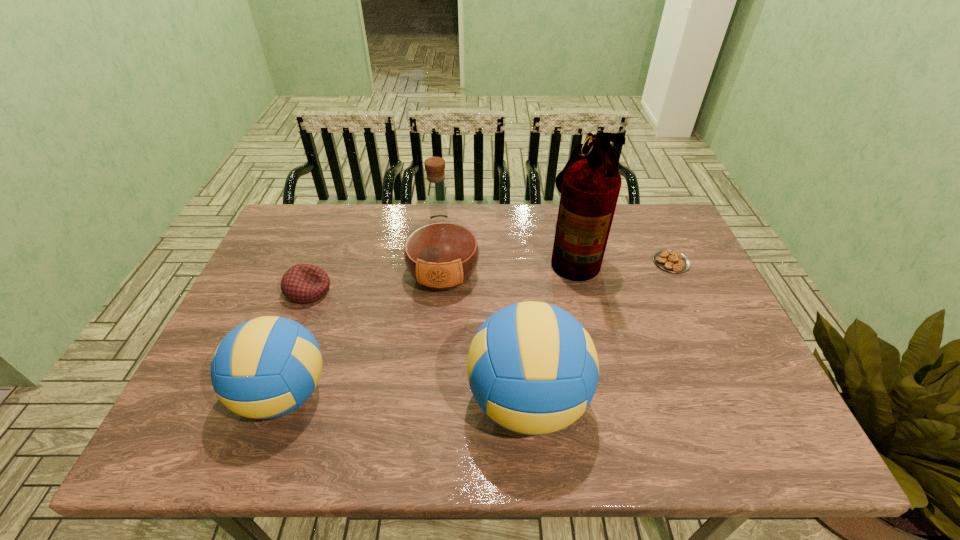
Find the location of a particular element. object that is positioned at the right edge is located at coordinates (669, 260).

Where is `object located at the near left corner`? object located at the near left corner is located at coordinates (266, 367).

This screenshot has height=540, width=960. What are the coordinates of `vacant space at the far edge` in the screenshot? It's located at (447, 204).

Where is `vacant space at the near edge of the desktop`? vacant space at the near edge of the desktop is located at coordinates (694, 412).

Locate an element on the screen. free space at the left edge of the desktop is located at coordinates (256, 307).

Image resolution: width=960 pixels, height=540 pixels. I want to click on free region at the right edge of the desktop, so click(x=647, y=270).

In the image, there is a desktop. Identify the location of free space at the far left corner. This screenshot has height=540, width=960. 290,213.

Identify the location of free point at the far right corner. This screenshot has width=960, height=540. (644, 226).

You are a GUI agent. You are given a task and a screenshot of the screen. Output one action in this format:
    pyautogui.click(x=<x>, y=<y>)
    Task: Click on the vacant region at the near right corner
    The height and width of the screenshot is (540, 960).
    Given the screenshot: What is the action you would take?
    pyautogui.click(x=723, y=408)

Locate an element on the screen. The width and height of the screenshot is (960, 540). blank region between the rightmost object and the beanbag is located at coordinates (490, 276).